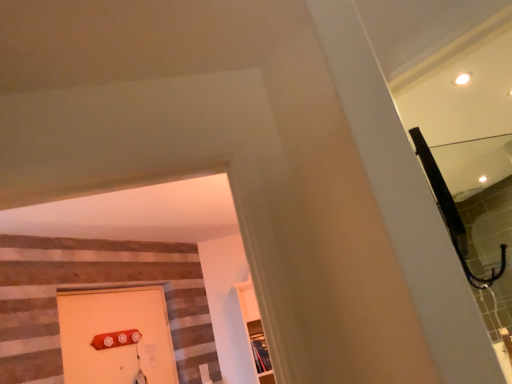
Question: Is clear glass mirror at upper right situated inside wooden shelf at center or outside?

Choices:
 (A) inside
 (B) outside

Answer: (B)

Question: Relative to wooden shelf at center, is clear glass mirror at upper right in front or behind?

Choices:
 (A) behind
 (B) front

Answer: (B)

Question: Which of these objects is positioned farthest from the matte orange door at lower left?

Choices:
 (A) clear glass mirror at upper right
 (B) wooden shelf at center

Answer: (A)

Question: Estimate the real-world distances between objects in this image. Which object is farther from the clear glass mirror at upper right?

Choices:
 (A) matte orange door at lower left
 (B) wooden shelf at center

Answer: (A)